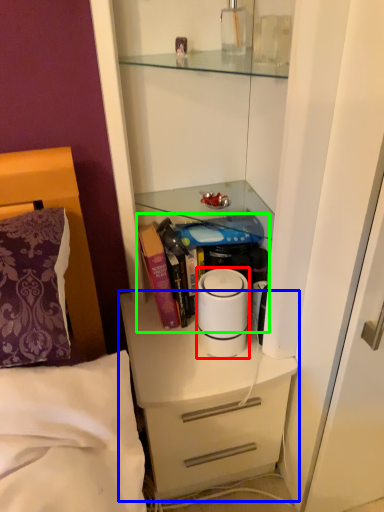
Question: Considering the real-world distances, which object is closest to home appliance (highlighted by a red box)? chest of drawers (highlighted by a blue box) or book (highlighted by a green box).

Choices:
 (A) chest of drawers
 (B) book

Answer: (B)